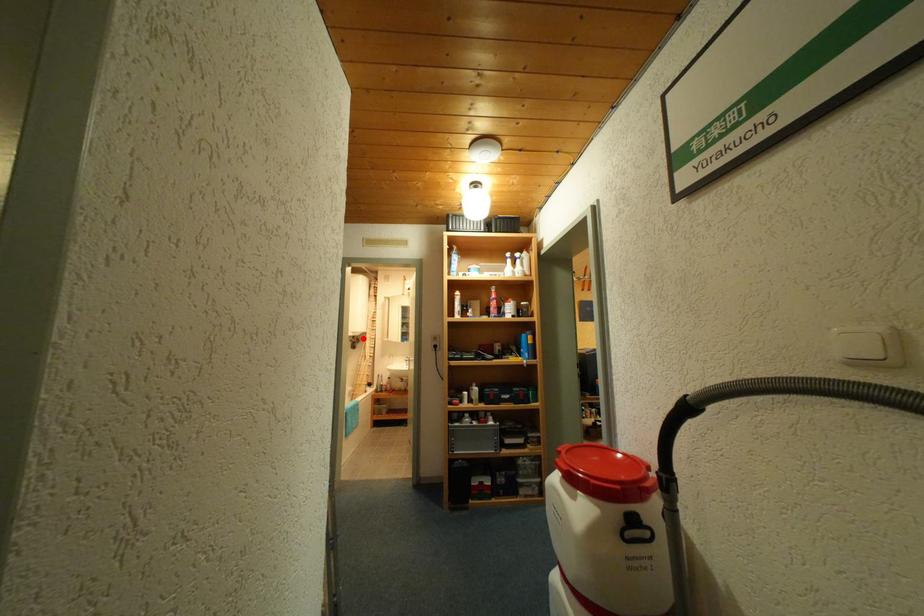
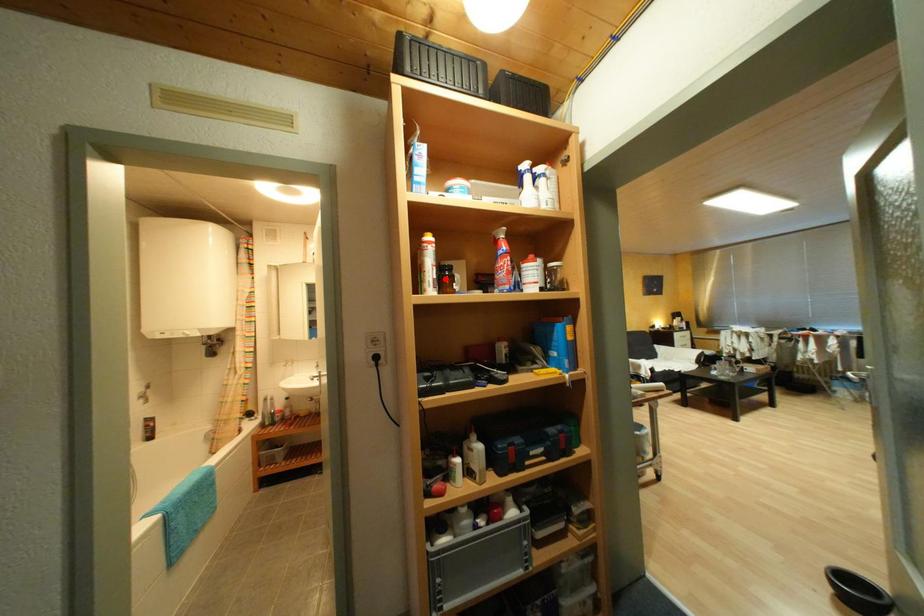
I am providing you with two images of the same scene from different viewpoints. A red point is marked on the first image and another point is marked on the second image. Do the highlighted points in image1 and image2 indicate the same real-world spot?

No